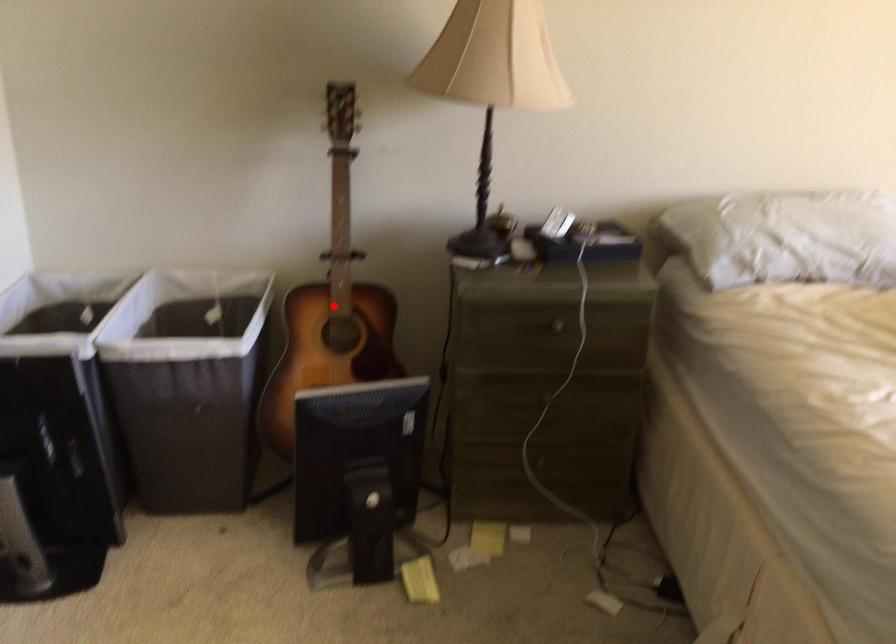
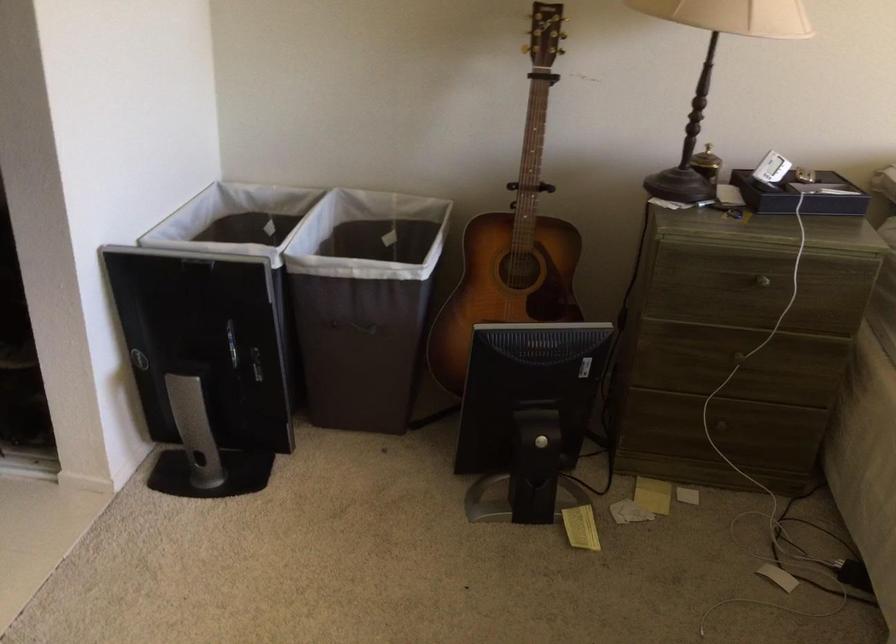
In the second image, find the point that corresponds to the highlighted location in the first image.

(513, 237)